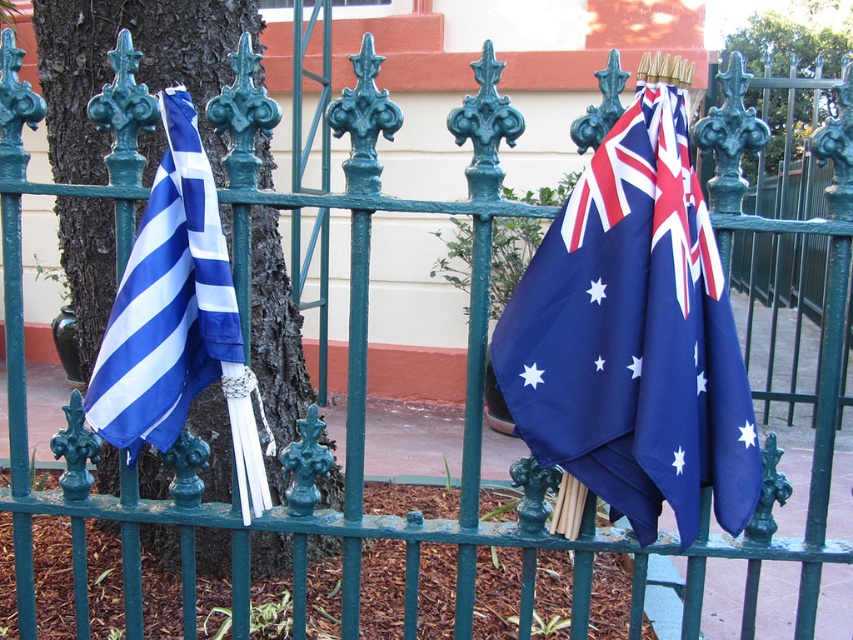
Can you confirm if navy blue fabric flag at center is smaller than blue/white striped fabric at left?

Actually, navy blue fabric flag at center might be larger than blue/white striped fabric at left.

Is point (660, 230) less distant than point (140, 339)?

Yes, it is in front of point (140, 339).

Find the location of a particular element. The width and height of the screenshot is (853, 640). navy blue fabric flag at center is located at coordinates (633, 337).